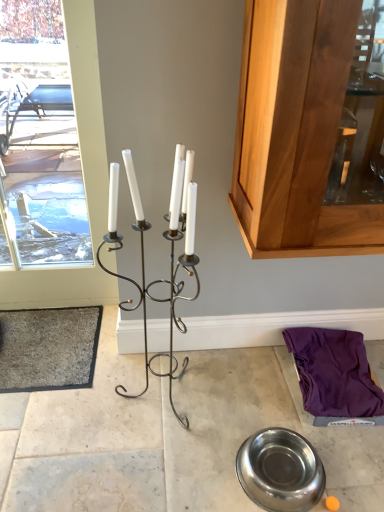
The image size is (384, 512). Find the location of `vacant space underneath gray carpet at lower left (from a real-world perspective)`. vacant space underneath gray carpet at lower left (from a real-world perspective) is located at coordinates (33, 352).